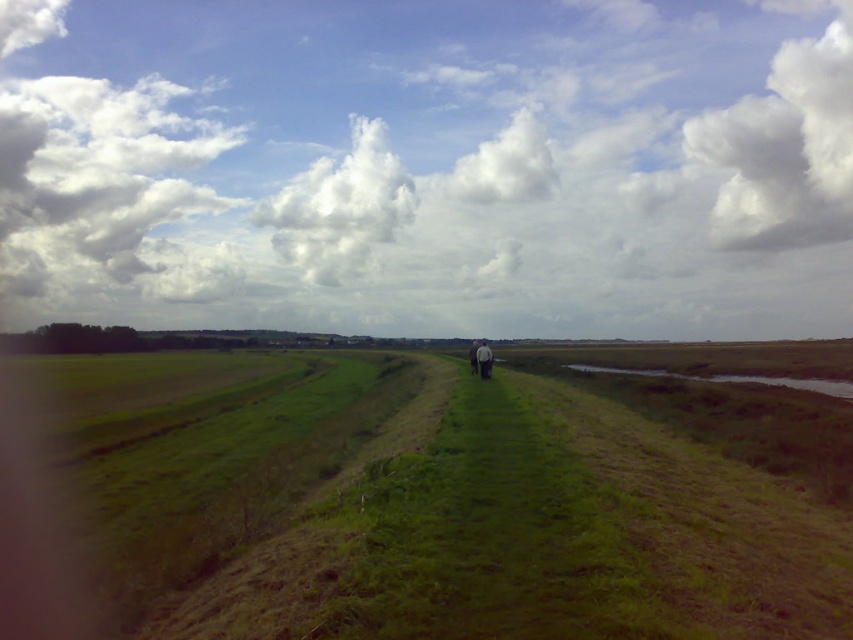
You are a photographer trying to capture the white fabric couple at center while standing on the green grassy path at center. Which object is wider in the image?

The green grassy path at center is wider than the white fabric couple at center according to the description.